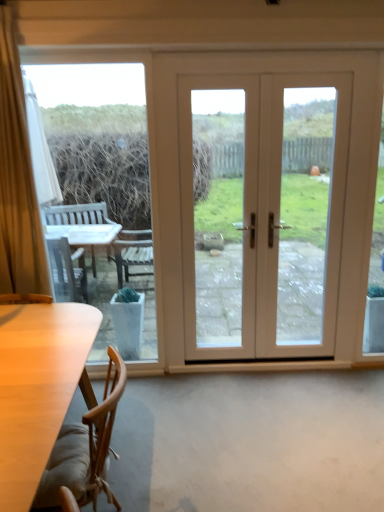
Question: Is white glossy door at center to the left or to the right of wooden chair at lower left in the image?

Choices:
 (A) left
 (B) right

Answer: (B)

Question: Choose the correct answer: Is white glossy door at center inside wooden chair at lower left or outside it?

Choices:
 (A) inside
 (B) outside

Answer: (B)

Question: Which object is the farthest from the transparent glass table at left?

Choices:
 (A) wooden chair at lower left
 (B) white glossy door at center

Answer: (B)

Question: Which of these objects is positioned closest to the white glossy door at center?

Choices:
 (A) transparent glass table at left
 (B) wooden chair at lower left

Answer: (A)